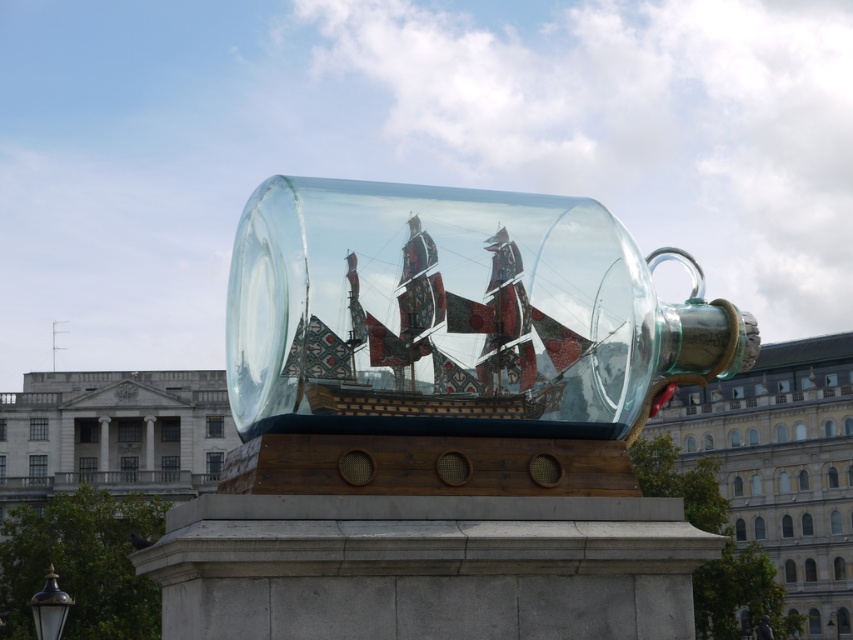
Does transparent glass ship at center have a greater height compared to polished wooden ship at center?

Correct, transparent glass ship at center is much taller as polished wooden ship at center.

Is point (303, 406) farther from camera compared to point (448, 307)?

That is False.

Find the location of a particular element. The height and width of the screenshot is (640, 853). transparent glass ship at center is located at coordinates (456, 314).